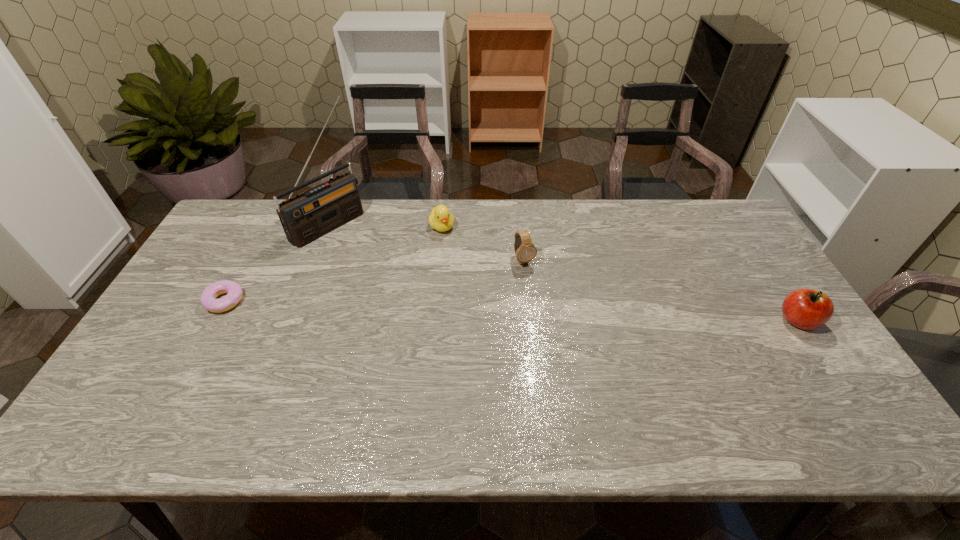
Locate an element on the screen. free point between the leftmost object and the third object from right to left is located at coordinates coord(333,264).

In order to click on free space between the fourth object from right to left and the watch in this screenshot , I will do `click(426, 242)`.

This screenshot has width=960, height=540. Find the location of `blank region between the watch and the radio receiver`. blank region between the watch and the radio receiver is located at coordinates (426, 242).

You are a GUI agent. You are given a task and a screenshot of the screen. Output one action in this format:
    pyautogui.click(x=<x>, y=<y>)
    Task: Click on the vacant point located between the rightmost object and the shortest object
    
    Given the screenshot: What is the action you would take?
    pyautogui.click(x=512, y=311)

Locate an element on the screen. free space between the third object from right to left and the fourth object from left to right is located at coordinates (483, 244).

Where is `free space between the third object from right to left and the rightmost object`? This screenshot has width=960, height=540. free space between the third object from right to left and the rightmost object is located at coordinates (620, 274).

Identify the location of vacant space that's between the second object from right to left and the second shortest object. Image resolution: width=960 pixels, height=540 pixels. (483, 244).

Locate an element on the screen. The width and height of the screenshot is (960, 540). empty location between the tallest object and the apple is located at coordinates (564, 272).

Locate an element on the screen. The width and height of the screenshot is (960, 540). blank region between the second object from left to right and the third object from right to left is located at coordinates (385, 225).

Where is `object that stands as the third closest to the third nearest object`? This screenshot has height=540, width=960. object that stands as the third closest to the third nearest object is located at coordinates (807, 309).